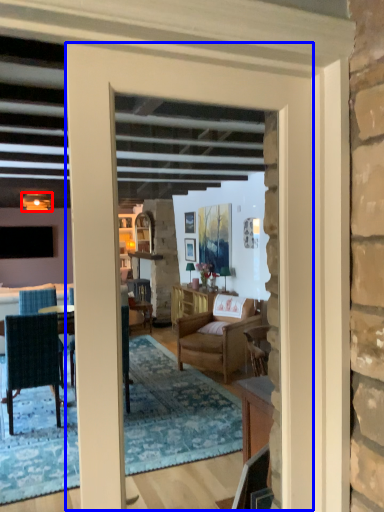
Question: Which point is further to the camera, lamp (highlighted by a red box) or door (highlighted by a blue box)?

Choices:
 (A) lamp
 (B) door

Answer: (A)